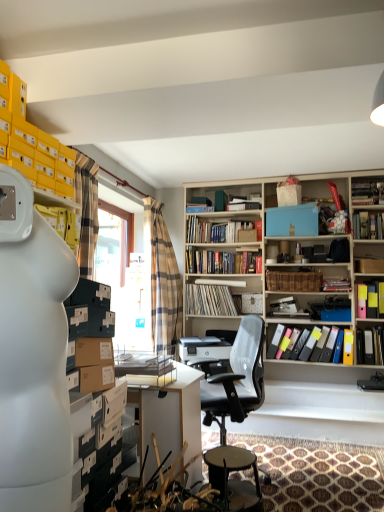
Question: Is white vinyl records at center, positioned as the eighth book in top-to-bottom order, positioned in front of yellow file folder at right, which ranks as the ninth book in top-to-bottom order?

Choices:
 (A) yes
 (B) no

Answer: (B)

Question: From a real-world perspective, is white vinyl records at center, positioned as the eighth book in top-to-bottom order, over yellow file folder at right, which appears as the second book when ordered from the bottom?

Choices:
 (A) no
 (B) yes

Answer: (B)

Question: Considering the relative positions of white vinyl records at center, which is the third book from bottom to top, and yellow file folder at right, which appears as the second book when ordered from the bottom, in the image provided, is white vinyl records at center, which is the third book from bottom to top, behind yellow file folder at right, which appears as the second book when ordered from the bottom,?

Choices:
 (A) yes
 (B) no

Answer: (A)

Question: Considering the relative sizes of white vinyl records at center, positioned as the eighth book in top-to-bottom order, and yellow file folder at right, which ranks as the ninth book in top-to-bottom order, in the image provided, is white vinyl records at center, positioned as the eighth book in top-to-bottom order, wider than yellow file folder at right, which ranks as the ninth book in top-to-bottom order,?

Choices:
 (A) yes
 (B) no

Answer: (A)

Question: Is white vinyl records at center, positioned as the eighth book in top-to-bottom order, bigger than yellow file folder at right, which ranks as the ninth book in top-to-bottom order?

Choices:
 (A) no
 (B) yes

Answer: (B)

Question: Which is correct: black mesh office chair at center is inside transparent plastic window screen at center, or outside of it?

Choices:
 (A) outside
 (B) inside

Answer: (A)

Question: Relative to transparent plastic window screen at center, is black mesh office chair at center in front or behind?

Choices:
 (A) front
 (B) behind

Answer: (A)

Question: Considering the positions of black mesh office chair at center and transparent plastic window screen at center in the image, is black mesh office chair at center taller or shorter than transparent plastic window screen at center?

Choices:
 (A) short
 (B) tall

Answer: (A)

Question: From a real-world perspective, is black mesh office chair at center physically located above or below transparent plastic window screen at center?

Choices:
 (A) below
 (B) above

Answer: (A)

Question: From a real-world perspective, relative to black mesh office chair at center, is hardcover books at center, the 4th book when ordered from top to bottom, vertically above or below?

Choices:
 (A) below
 (B) above

Answer: (B)

Question: Considering their positions, is hardcover books at center, the 4th book when ordered from top to bottom, located in front of or behind black mesh office chair at center?

Choices:
 (A) behind
 (B) front

Answer: (A)

Question: Looking at the image, does hardcover books at center, placed as the seventh book when sorted from bottom to top, seem bigger or smaller compared to black mesh office chair at center?

Choices:
 (A) big
 (B) small

Answer: (B)

Question: From the image's perspective, is hardcover books at center, the 4th book when ordered from top to bottom, located above or below black mesh office chair at center?

Choices:
 (A) below
 (B) above

Answer: (B)

Question: Does point (372, 295) appear closer or farther from the camera than point (223, 240)?

Choices:
 (A) closer
 (B) farther

Answer: (A)

Question: Is multicolored file folders at upper right, which is counted as the seventh book, starting from the top, wider or thinner than hardcover books at center, placed as the seventh book when sorted from bottom to top?

Choices:
 (A) thin
 (B) wide

Answer: (B)